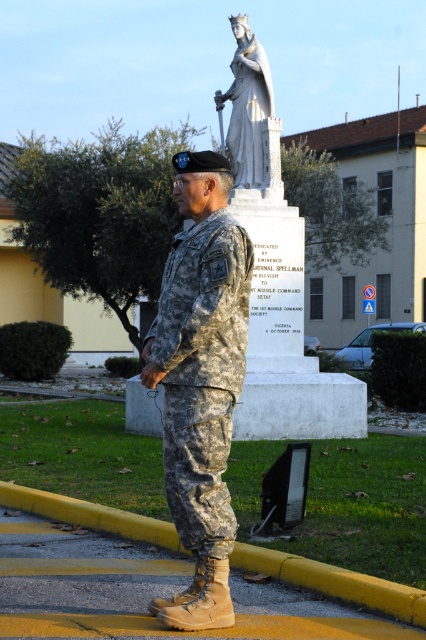
You are an artist sketching the scene from a distance. Which object should you draw first, the camouflage uniform at center or the white marble statue at upper center, considering their sizes in the image?

The white marble statue at upper center should be drawn first because it occupies more space than the camouflage uniform at center, as per the description.